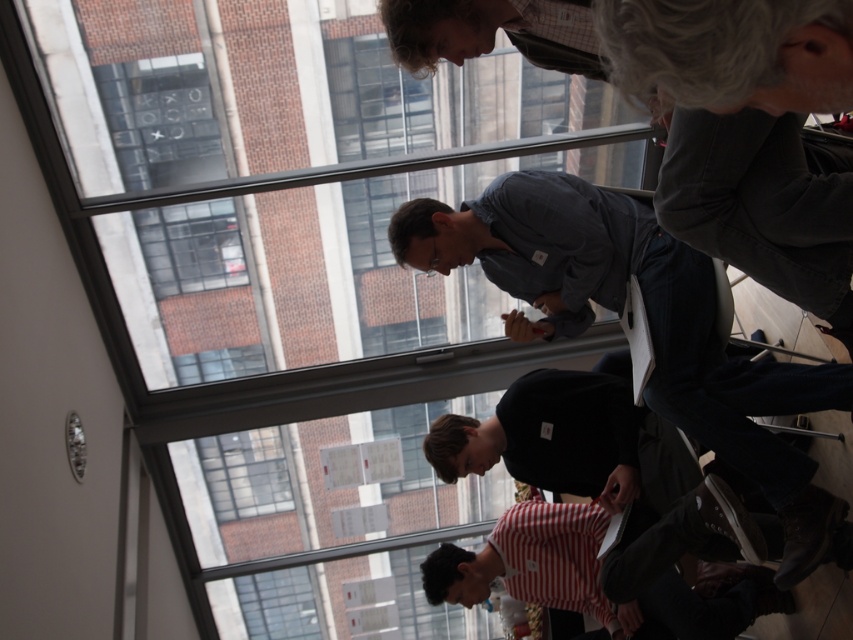
Question: Does denim shirt at center appear over striped cotton shirt at lower center?

Choices:
 (A) no
 (B) yes

Answer: (B)

Question: Which point appears closest to the camera in this image?

Choices:
 (A) (820, 378)
 (B) (659, 609)

Answer: (A)

Question: In this image, where is denim shirt at center located relative to striped cotton shirt at lower center?

Choices:
 (A) below
 (B) above

Answer: (B)

Question: Which of the following is the closest to the observer?

Choices:
 (A) denim shirt at center
 (B) striped cotton shirt at lower center

Answer: (A)

Question: Is denim shirt at center to the left of striped cotton shirt at lower center from the viewer's perspective?

Choices:
 (A) no
 (B) yes

Answer: (B)

Question: Which object appears farthest from the camera in this image?

Choices:
 (A) denim shirt at center
 (B) striped cotton shirt at lower center

Answer: (B)